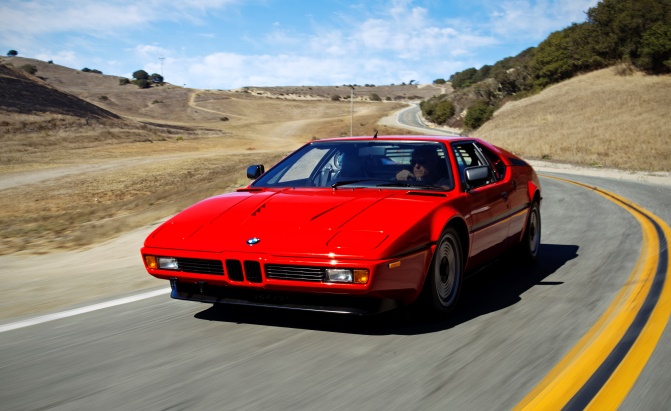
I want to click on hood, so click(x=372, y=223).